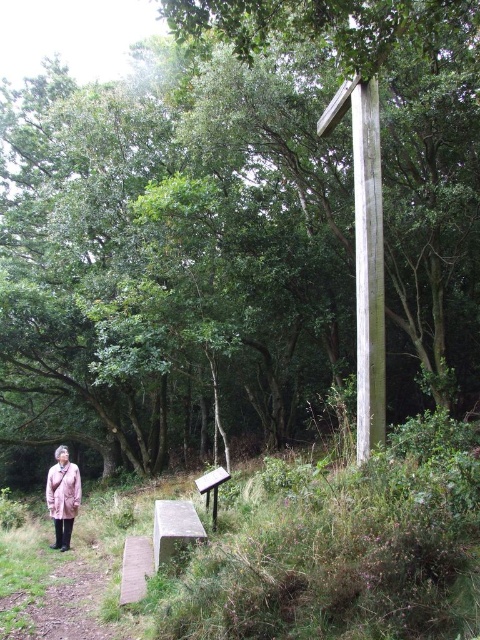
Question: Which point is farther from the camera taking this photo?

Choices:
 (A) (142, 556)
 (B) (181, 538)

Answer: (A)

Question: Does white stone bench at lower center come in front of brown wooden bench at lower center?

Choices:
 (A) no
 (B) yes

Answer: (A)

Question: Is white stone bench at lower center closer to the viewer compared to brown wooden bench at lower center?

Choices:
 (A) no
 (B) yes

Answer: (A)

Question: Which of these objects is positioned farthest from the weathered wood pole at right?

Choices:
 (A) white stone bench at lower center
 (B) brown wooden bench at lower center
 (C) light brown textured jacket at lower left

Answer: (C)

Question: Is brown wooden bench at lower center above light brown textured jacket at lower left?

Choices:
 (A) no
 (B) yes

Answer: (B)

Question: Estimate the real-world distances between objects in this image. Which object is closer to the white stone bench at lower center?

Choices:
 (A) weathered wood pole at right
 (B) brown wooden bench at lower center

Answer: (B)